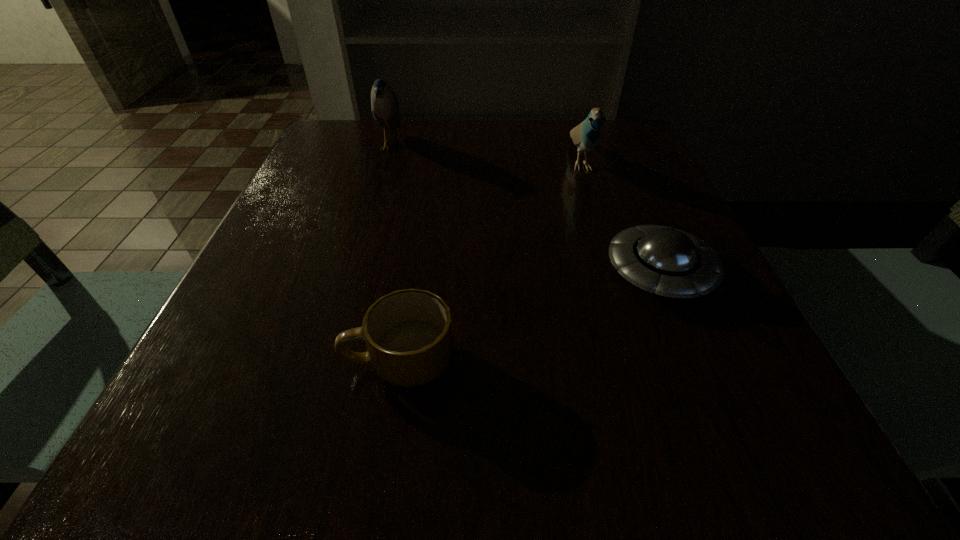
The width and height of the screenshot is (960, 540). What are the coordinates of `free spot between the left bird and the nearest object` in the screenshot? It's located at (396, 253).

Where is `free spot between the third farthest object and the right bird`? free spot between the third farthest object and the right bird is located at coordinates (620, 217).

This screenshot has width=960, height=540. Identify the location of unoccupied area between the leftmost object and the right bird. (485, 154).

Locate an element on the screen. This screenshot has height=540, width=960. object that is the closest one to the nearest object is located at coordinates (672, 263).

I want to click on object that can be found as the third closest to the left bird, so click(x=408, y=333).

I want to click on vacant area that satisfies the following two spatial constraints: 1. on the back side of the second nearest object; 2. at the tip of the left bird's beak, so click(606, 146).

What are the coordinates of `vacant space that satisfies the following two spatial constraints: 1. at the tip of the left bird's beak; 2. on the side with the handle of the second object from left to right` in the screenshot? It's located at (324, 361).

Find the location of a particular element. The image size is (960, 540). vacant point that satisfies the following two spatial constraints: 1. at the face of the right bird; 2. on the left side of the third farthest object is located at coordinates (615, 272).

Find the location of `free region that satisfies the following two spatial constraints: 1. at the tip of the leftmost object's beak; 2. on the back side of the second nearest object`. free region that satisfies the following two spatial constraints: 1. at the tip of the leftmost object's beak; 2. on the back side of the second nearest object is located at coordinates (351, 272).

The width and height of the screenshot is (960, 540). In order to click on vacant space that satisfies the following two spatial constraints: 1. on the side with the handle of the nearest object; 2. on the right side of the second nearest object in this screenshot , I will do `click(414, 272)`.